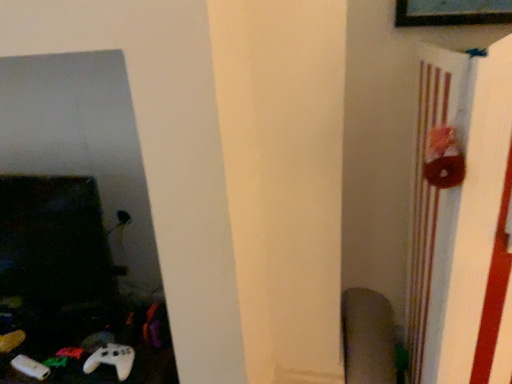
Describe the element at coordinates (112, 359) in the screenshot. This screenshot has height=384, width=512. I see `white matte game controller at lower left` at that location.

Identify the location of white matte game controller at lower left. tap(112, 359).

Is brown fabric bulletin board at right not near velvet-like gray swivel chair at lower right?

No, there isn't a large distance between brown fabric bulletin board at right and velvet-like gray swivel chair at lower right.

Does brown fabric bulletin board at right have a smaller size compared to velvet-like gray swivel chair at lower right?

Incorrect, brown fabric bulletin board at right is not smaller in size than velvet-like gray swivel chair at lower right.

Is brown fabric bulletin board at right oriented away from velvet-like gray swivel chair at lower right?

No, brown fabric bulletin board at right is not facing away from velvet-like gray swivel chair at lower right.

Is brown fabric bulletin board at right to the left or to the right of white matte game controller at lower left in the image?

Clearly, brown fabric bulletin board at right is on the right of white matte game controller at lower left in the image.

Is brown fabric bulletin board at right in contact with white matte game controller at lower left?

No.

From a real-world perspective, which object rests below the other?

In real-world perspective, white matte game controller at lower left is lower.

Between white matte game controller at lower left and velvet-like gray swivel chair at lower right, which one has more height?

velvet-like gray swivel chair at lower right.

Is velvet-like gray swivel chair at lower right a part of white matte game controller at lower left?

No, velvet-like gray swivel chair at lower right is not inside white matte game controller at lower left.

Is white matte game controller at lower left turned away from velvet-like gray swivel chair at lower right?

No, white matte game controller at lower left is not facing the opposite direction of velvet-like gray swivel chair at lower right.

From the picture: Would you say velvet-like gray swivel chair at lower right is inside or outside brown fabric bulletin board at right?

velvet-like gray swivel chair at lower right is not enclosed by brown fabric bulletin board at right.

Is velvet-like gray swivel chair at lower right far away from brown fabric bulletin board at right?

No, velvet-like gray swivel chair at lower right is not far away from brown fabric bulletin board at right.

Considering the relative sizes of velvet-like gray swivel chair at lower right and brown fabric bulletin board at right in the image provided, is velvet-like gray swivel chair at lower right shorter than brown fabric bulletin board at right?

Yes, velvet-like gray swivel chair at lower right is shorter than brown fabric bulletin board at right.

From the picture: Is velvet-like gray swivel chair at lower right aimed at brown fabric bulletin board at right?

No, velvet-like gray swivel chair at lower right is not oriented towards brown fabric bulletin board at right.

Does white matte game controller at lower left appear on the right side of brown fabric bulletin board at right?

No, white matte game controller at lower left is not to the right of brown fabric bulletin board at right.

At what (x,y) coordinates should I click in order to perform the action: click on game controller located on the left of brown fabric bulletin board at right. Please return your answer as a coordinate pair (x, y). The width and height of the screenshot is (512, 384). Looking at the image, I should click on (112, 359).

Can you tell me how much white matte game controller at lower left and brown fabric bulletin board at right differ in facing direction?

white matte game controller at lower left and brown fabric bulletin board at right are facing 1.73 degrees away from each other.

Consider the image. How far apart are velvet-like gray swivel chair at lower right and white matte game controller at lower left?

velvet-like gray swivel chair at lower right is 35.23 inches from white matte game controller at lower left.

The width and height of the screenshot is (512, 384). Identify the location of game controller above the velvet-like gray swivel chair at lower right (from a real-world perspective). (112, 359).

Which object is positioned more to the left, velvet-like gray swivel chair at lower right or white matte game controller at lower left?

white matte game controller at lower left is more to the left.

Does velvet-like gray swivel chair at lower right have a smaller size compared to white matte game controller at lower left?

No.

At what (x,y) coordinates should I click in order to perform the action: click on swivel chair directly beneath the brown fabric bulletin board at right (from a real-world perspective). Please return your answer as a coordinate pair (x, y). Looking at the image, I should click on (368, 337).

Where is `bulletin board above the white matte game controller at lower left (from the image's perspective)`? This screenshot has height=384, width=512. bulletin board above the white matte game controller at lower left (from the image's perspective) is located at coordinates (457, 207).

Looking at the image, which one is located closer to white matte game controller at lower left, velvet-like gray swivel chair at lower right or brown fabric bulletin board at right?

The object closer to white matte game controller at lower left is velvet-like gray swivel chair at lower right.

When comparing their distances from brown fabric bulletin board at right, does white matte game controller at lower left or velvet-like gray swivel chair at lower right seem further?

white matte game controller at lower left is positioned further to the anchor brown fabric bulletin board at right.

When comparing their distances from velvet-like gray swivel chair at lower right, does brown fabric bulletin board at right or white matte game controller at lower left seem closer?

The object closer to velvet-like gray swivel chair at lower right is brown fabric bulletin board at right.

Consider the image. Estimate the real-world distances between objects in this image. Which object is further from white matte game controller at lower left, brown fabric bulletin board at right or velvet-like gray swivel chair at lower right?

brown fabric bulletin board at right is further to white matte game controller at lower left.

Which object lies further to the anchor point brown fabric bulletin board at right, velvet-like gray swivel chair at lower right or white matte game controller at lower left?

white matte game controller at lower left is further to brown fabric bulletin board at right.

Which object lies further to the anchor point velvet-like gray swivel chair at lower right, white matte game controller at lower left or brown fabric bulletin board at right?

white matte game controller at lower left is positioned further to the anchor velvet-like gray swivel chair at lower right.

Locate an element on the screen. swivel chair located between white matte game controller at lower left and brown fabric bulletin board at right in the left-right direction is located at coordinates (368, 337).